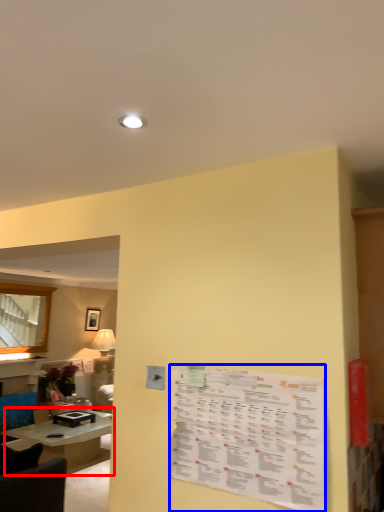
Question: Which object is further to the camera taking this photo, table (highlighted by a red box) or menu (highlighted by a blue box)?

Choices:
 (A) table
 (B) menu

Answer: (A)